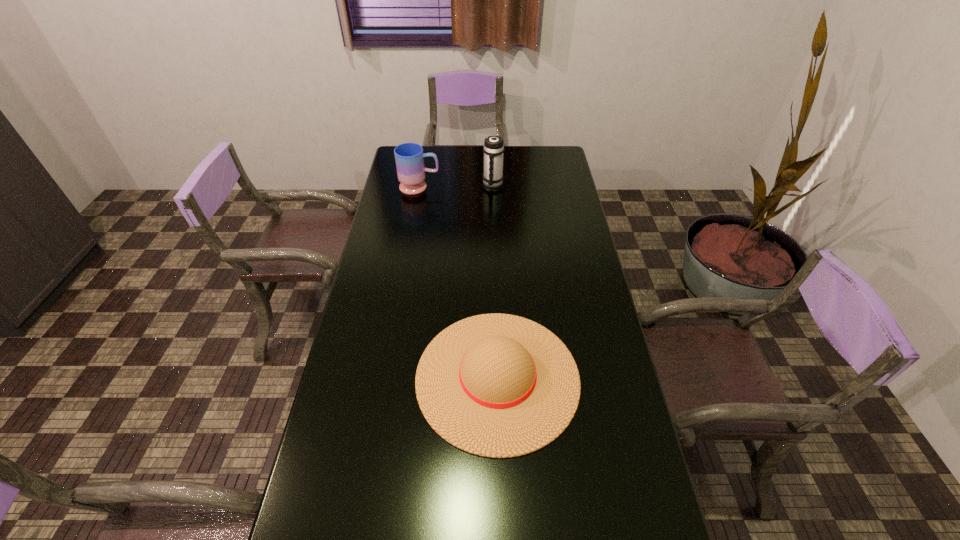
The image size is (960, 540). In order to click on vacant space that satisfies the following two spatial constraints: 1. on the side of the mug with the handle; 2. on the right side of the bonnet in this screenshot , I will do `click(387, 377)`.

Identify the location of vacant region that satisfies the following two spatial constraints: 1. on the side of the bonnet with the handle; 2. on the left side of the mug. This screenshot has width=960, height=540. (387, 377).